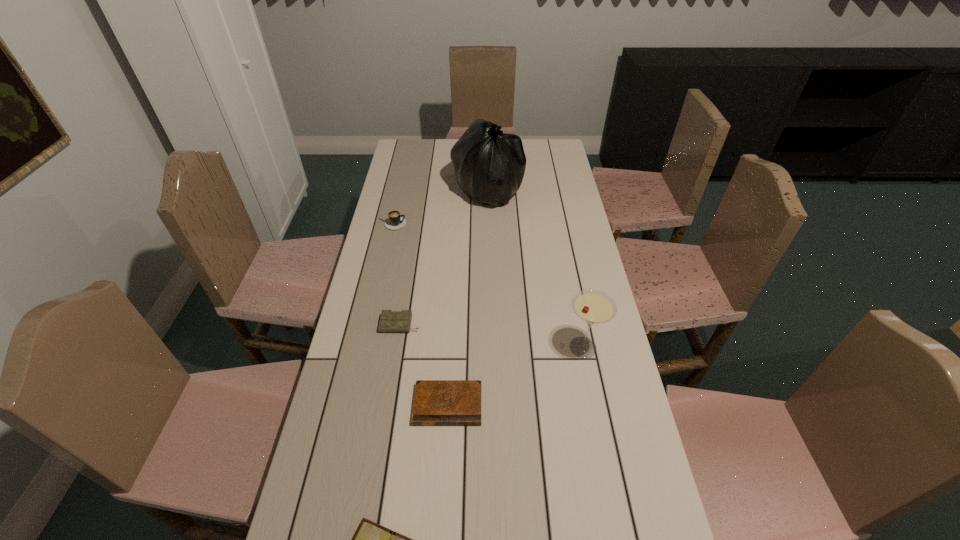
Locate an element on the screen. The width and height of the screenshot is (960, 540). blank region between the fifth shortest object and the farthest diary is located at coordinates (492, 336).

The width and height of the screenshot is (960, 540). I want to click on vacant space that is in between the martini and the plastic bag, so click(536, 269).

Identify the location of vacant area between the farthest diary and the martini. The width and height of the screenshot is (960, 540). (492, 336).

Locate an element on the screen. This screenshot has height=540, width=960. unoccupied area between the farthest object and the second nearest object is located at coordinates (468, 298).

The height and width of the screenshot is (540, 960). Identify the location of free area in between the farthest diary and the second nearest object. (424, 364).

The image size is (960, 540). Find the location of `empty space that is in between the second nearest diary and the fourth shortest object`. empty space that is in between the second nearest diary and the fourth shortest object is located at coordinates (420, 314).

Find the location of `the second closest object relative to the martini`. the second closest object relative to the martini is located at coordinates (390, 321).

The image size is (960, 540). In order to click on the third closest object relative to the plastic bag in this screenshot , I will do `click(594, 307)`.

Image resolution: width=960 pixels, height=540 pixels. In order to click on diary that is the closest one to the nearest object in this screenshot , I will do `click(436, 402)`.

At what (x,y) coordinates should I click in order to perform the action: click on diary that stands as the closest to the second nearest object. Please return your answer as a coordinate pair (x, y). This screenshot has height=540, width=960. Looking at the image, I should click on (390, 321).